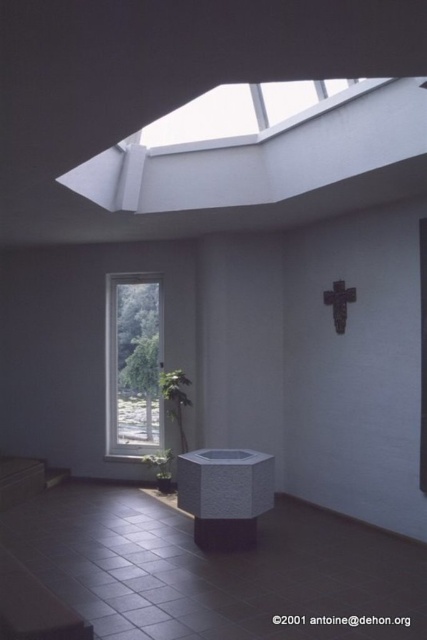
Can you confirm if clear glass window at center is positioned to the right of transparent glass skylight at upper center?

In fact, clear glass window at center is to the left of transparent glass skylight at upper center.

Is point (132, 298) more distant than point (309, 113)?

That is True.

Image resolution: width=427 pixels, height=640 pixels. What are the coordinates of `clear glass window at center` in the screenshot? It's located at (132, 364).

Image resolution: width=427 pixels, height=640 pixels. I want to click on clear glass window at center, so click(132, 364).